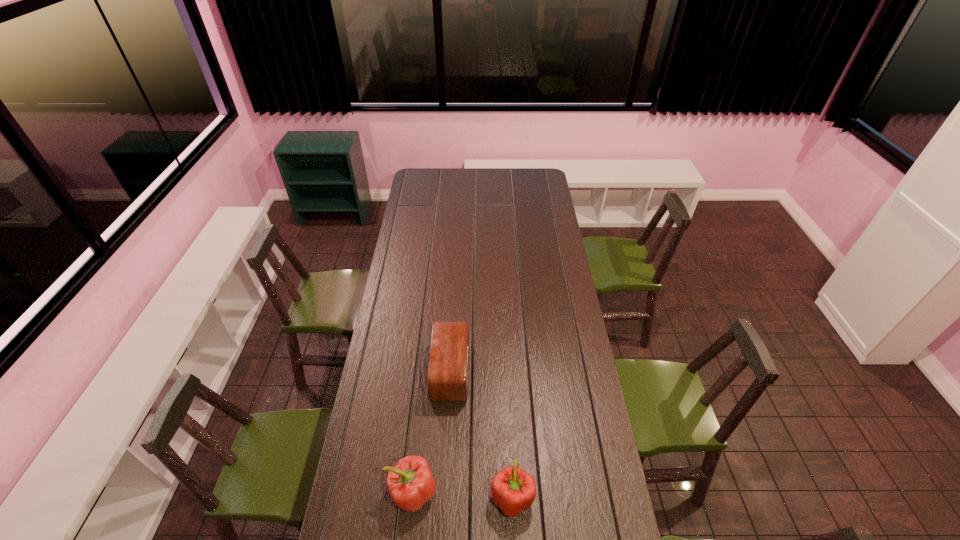
At what (x,y) coordinates should I click in order to perform the action: click on free space that is in between the left bell pepper and the radio receiver. Please return your answer as a coordinate pair (x, y). Image resolution: width=960 pixels, height=540 pixels. Looking at the image, I should click on (432, 432).

I want to click on free space that is in between the rightmost object and the left bell pepper, so click(x=463, y=495).

Locate an element on the screen. free space between the radio receiver and the left bell pepper is located at coordinates click(432, 432).

Locate an element on the screen. free spot between the left bell pepper and the radio receiver is located at coordinates (x=432, y=432).

Where is `free space that is in between the radio receiver and the left bell pepper`? free space that is in between the radio receiver and the left bell pepper is located at coordinates (432, 432).

Locate an element on the screen. unoccupied area between the rightmost object and the radio receiver is located at coordinates (481, 435).

Where is `free space between the farthest object and the left bell pepper`? free space between the farthest object and the left bell pepper is located at coordinates (432, 432).

I want to click on vacant area that lies between the left bell pepper and the right bell pepper, so coord(463,495).

This screenshot has width=960, height=540. What are the coordinates of `vacant area that lies between the left bell pepper and the radio receiver` in the screenshot? It's located at (432, 432).

You are a GUI agent. You are given a task and a screenshot of the screen. Output one action in this format:
    pyautogui.click(x=<x>, y=<y>)
    Task: Click on the vacant space that is in between the radio receiver and the left bell pepper
    This screenshot has height=540, width=960.
    Given the screenshot: What is the action you would take?
    pyautogui.click(x=432, y=432)